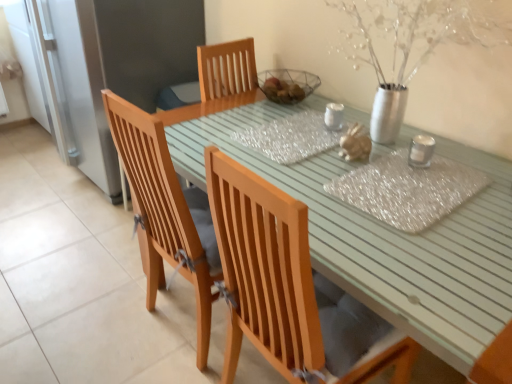
Image resolution: width=512 pixels, height=384 pixels. I want to click on free space to the left of translucent glass jar at center, so click(x=317, y=165).